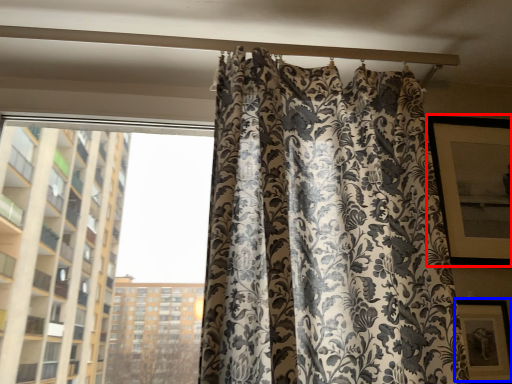
Question: Among these objects, which one is nearest to the camera, window screen (highlighted by a red box) or picture frame (highlighted by a blue box)?

Choices:
 (A) window screen
 (B) picture frame

Answer: (B)